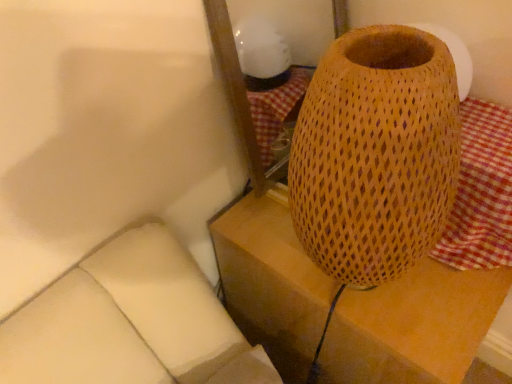
Question: Can you confirm if woven wood lampshade at right is thinner than red checkered fabric at right?

Choices:
 (A) no
 (B) yes

Answer: (A)

Question: Is woven wood lampshade at right to the right of red checkered fabric at right from the viewer's perspective?

Choices:
 (A) yes
 (B) no

Answer: (B)

Question: Is woven wood lampshade at right smaller than red checkered fabric at right?

Choices:
 (A) no
 (B) yes

Answer: (A)

Question: Could red checkered fabric at right be considered to be inside woven wood lampshade at right?

Choices:
 (A) yes
 (B) no

Answer: (B)

Question: Does woven wood lampshade at right lie behind red checkered fabric at right?

Choices:
 (A) yes
 (B) no

Answer: (A)

Question: Is red checkered fabric at right at the back of woven wood lampshade at right?

Choices:
 (A) yes
 (B) no

Answer: (B)

Question: Does red checkered fabric at right have a larger size compared to woven wood lampshade at right?

Choices:
 (A) no
 (B) yes

Answer: (A)

Question: Is red checkered fabric at right to the left of woven wood lampshade at right from the viewer's perspective?

Choices:
 (A) yes
 (B) no

Answer: (B)

Question: Is red checkered fabric at right completely or partially outside of woven wood lampshade at right?

Choices:
 (A) no
 (B) yes

Answer: (B)

Question: Is red checkered fabric at right thinner than woven wood lampshade at right?

Choices:
 (A) yes
 (B) no

Answer: (A)

Question: Considering the relative sizes of red checkered fabric at right and woven wood lampshade at right in the image provided, is red checkered fabric at right shorter than woven wood lampshade at right?

Choices:
 (A) yes
 (B) no

Answer: (A)

Question: From a real-world perspective, is red checkered fabric at right beneath woven wood lampshade at right?

Choices:
 (A) yes
 (B) no

Answer: (B)

Question: Would you say woven wood lampshade at right is inside or outside red checkered fabric at right?

Choices:
 (A) outside
 (B) inside

Answer: (A)